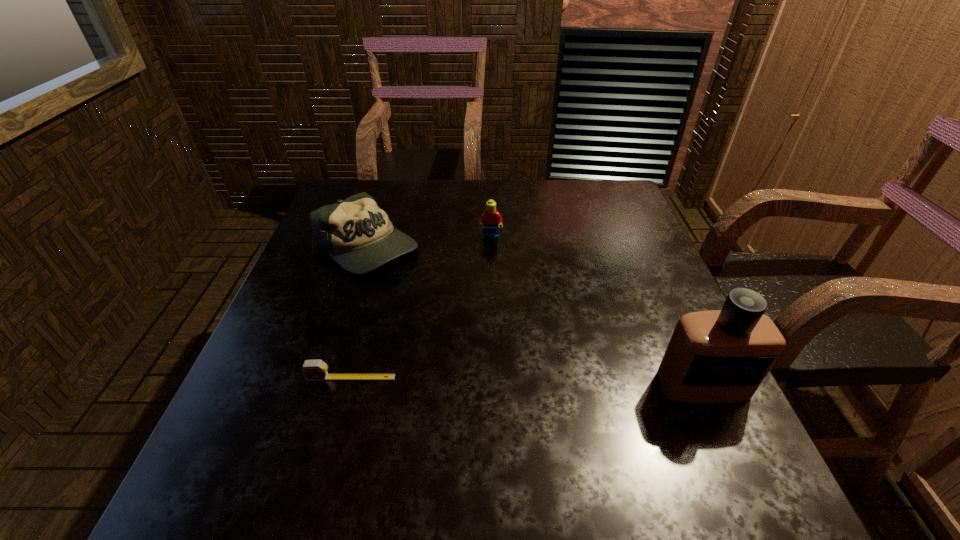
Identify the location of vacant space located 0.170m on the front-facing side of the baseball cap. This screenshot has height=540, width=960. (427, 316).

In order to click on vacant region located 0.200m on the front-facing side of the baseball cap in this screenshot , I will do `click(434, 325)`.

Locate an element on the screen. free space located 0.270m on the front-facing side of the baseball cap is located at coordinates [x=451, y=345].

You are a GUI agent. You are given a task and a screenshot of the screen. Output one action in this format:
    pyautogui.click(x=<x>, y=<y>)
    Task: Click on the object that is positioned at the far edge
    This screenshot has height=540, width=960.
    Given the screenshot: What is the action you would take?
    pos(356,233)

This screenshot has height=540, width=960. In order to click on object located in the near edge section of the desktop in this screenshot , I will do `click(715, 356)`.

Locate an element on the screen. This screenshot has height=540, width=960. tape measure that is at the left edge is located at coordinates (313, 370).

This screenshot has height=540, width=960. What are the coordinates of `baseball cap present at the left edge` in the screenshot? It's located at 356,233.

Find the location of `object that is at the right edge`. object that is at the right edge is located at coordinates (715, 356).

Where is `object positioned at the far left corner`? The height and width of the screenshot is (540, 960). object positioned at the far left corner is located at coordinates (356, 233).

I want to click on object at the near right corner, so click(x=715, y=356).